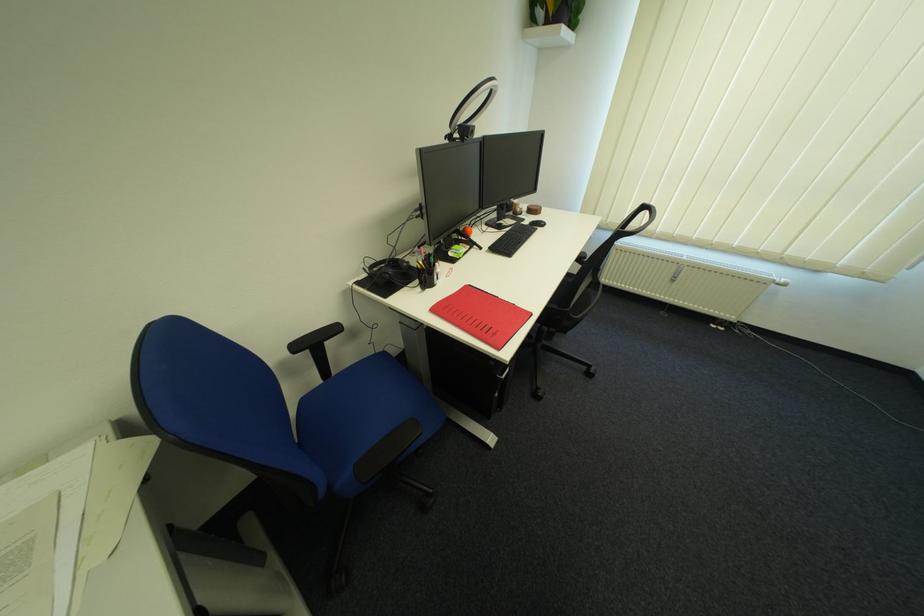
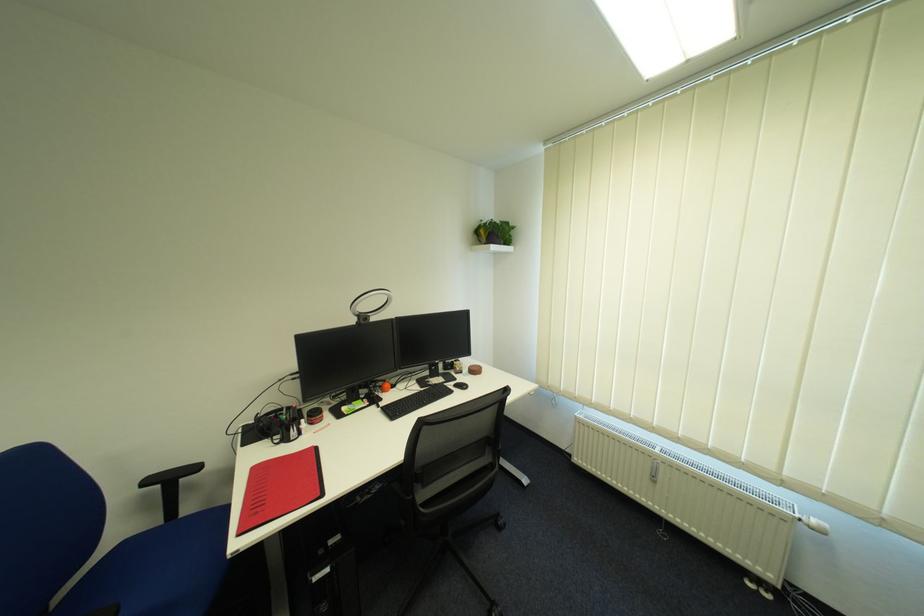
In the second image, find the point that corresponds to pixel 306 349 in the first image.

(157, 483)